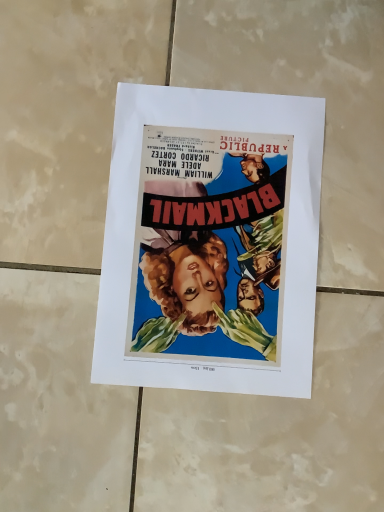
The width and height of the screenshot is (384, 512). What are the coordinates of `free space above matte paper poster at center (from a real-world perspective)` in the screenshot? It's located at (211, 230).